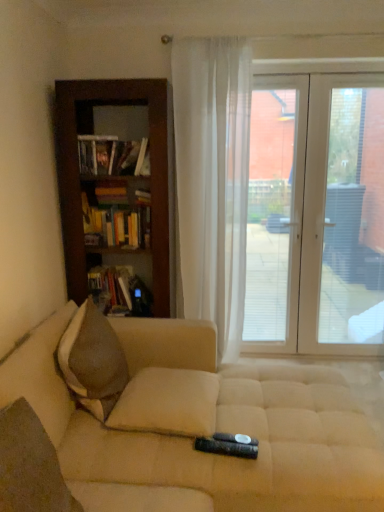
Image resolution: width=384 pixels, height=512 pixels. What are the coordinates of `blank space situated above transparent plastic window screen at center, the second window screen from the right (from a real-world perspective)` in the screenshot? It's located at (275, 80).